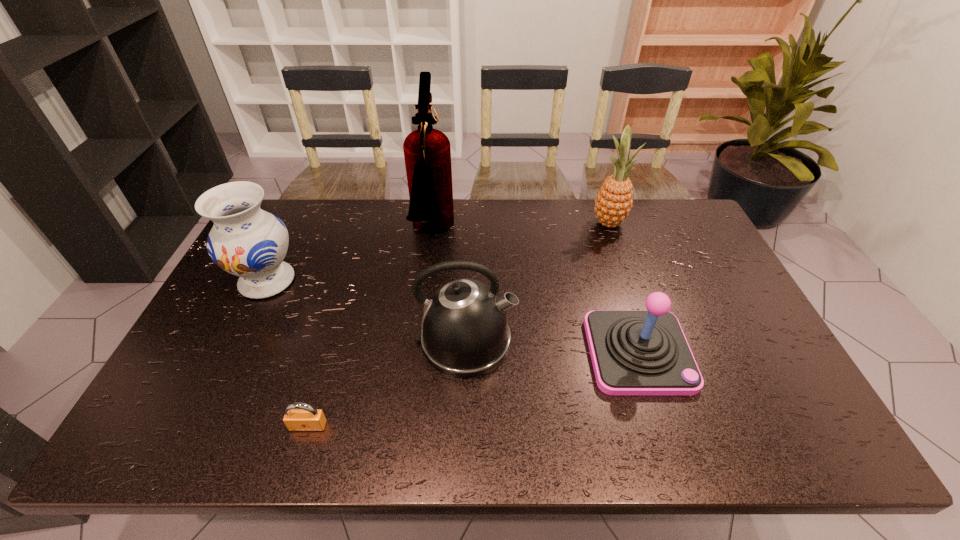
The image size is (960, 540). In order to click on fire extinguisher in this screenshot , I will do `click(427, 152)`.

Locate an element on the screen. Image resolution: width=960 pixels, height=540 pixels. pineapple is located at coordinates (614, 201).

This screenshot has height=540, width=960. What are the coordinates of `the leftmost object` in the screenshot? It's located at (246, 241).

Image resolution: width=960 pixels, height=540 pixels. I want to click on kettle, so click(464, 332).

This screenshot has width=960, height=540. Identify the location of the second shortest object. (634, 352).

I want to click on padlock, so click(x=299, y=416).

I want to click on the shortest object, so click(299, 416).

Where is `vacant space located at the nozzle of the tallest object`? The image size is (960, 540). vacant space located at the nozzle of the tallest object is located at coordinates (494, 232).

The width and height of the screenshot is (960, 540). I want to click on free space located on the left of the pineapple, so click(573, 222).

At what (x,y) coordinates should I click in order to perform the action: click on free space located on the front of the vase. Please return your answer as a coordinate pair (x, y). Image resolution: width=960 pixels, height=540 pixels. Looking at the image, I should click on (216, 385).